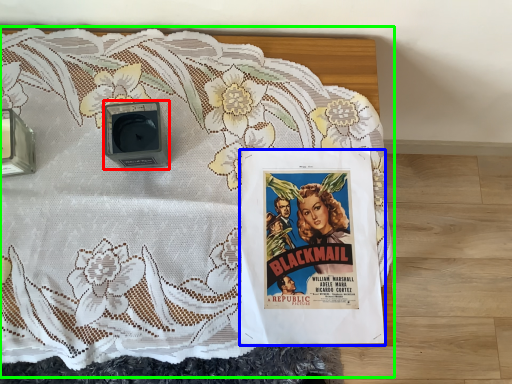
Question: Based on their relative distances, which object is farther from alarm (highlighted by a red box)? Choose from poster (highlighted by a blue box) and bed (highlighted by a green box).

Choices:
 (A) poster
 (B) bed

Answer: (A)